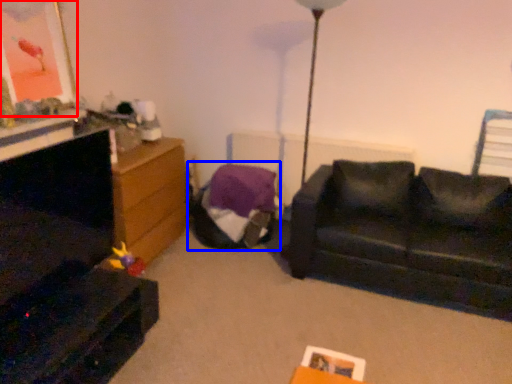
Question: Among these objects, which one is nearest to the camera, picture frame (highlighted by a red box) or bean bag chair (highlighted by a blue box)?

Choices:
 (A) picture frame
 (B) bean bag chair

Answer: (A)